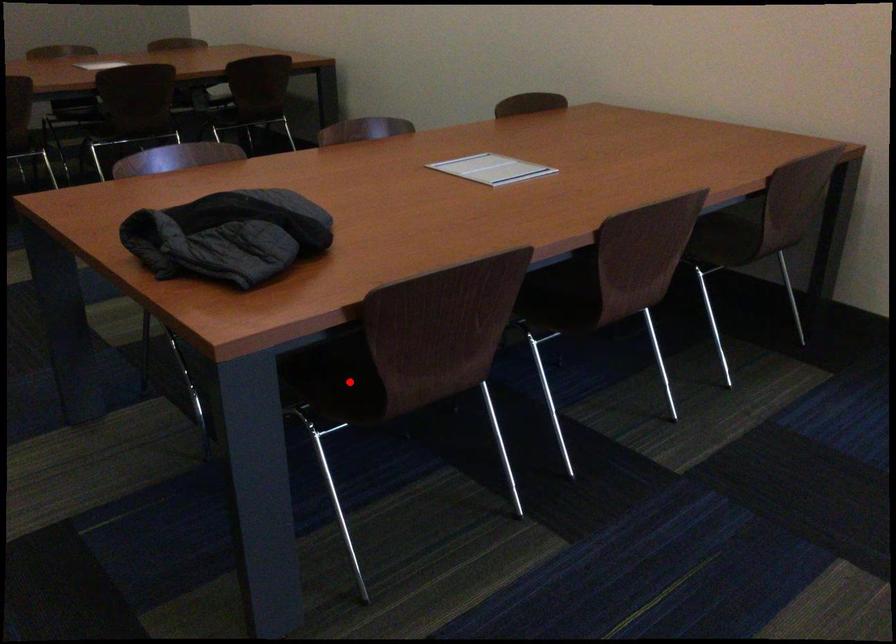
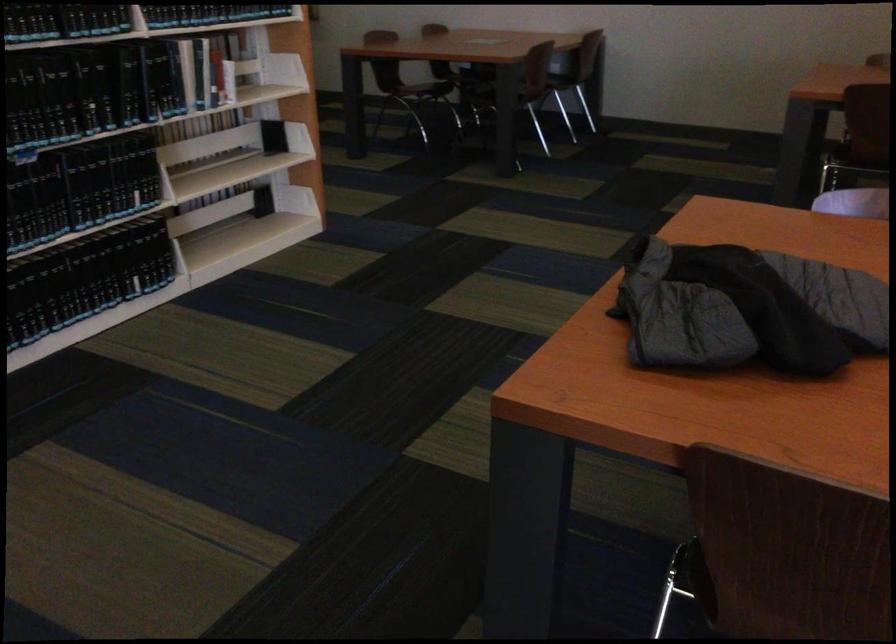
Question: I am providing you with two images of the same scene from different viewpoints. A red point is marked on the first image. At the location where the point appears in image 1, is it still visible in image 2?

Choices:
 (A) Yes
 (B) No

Answer: (B)